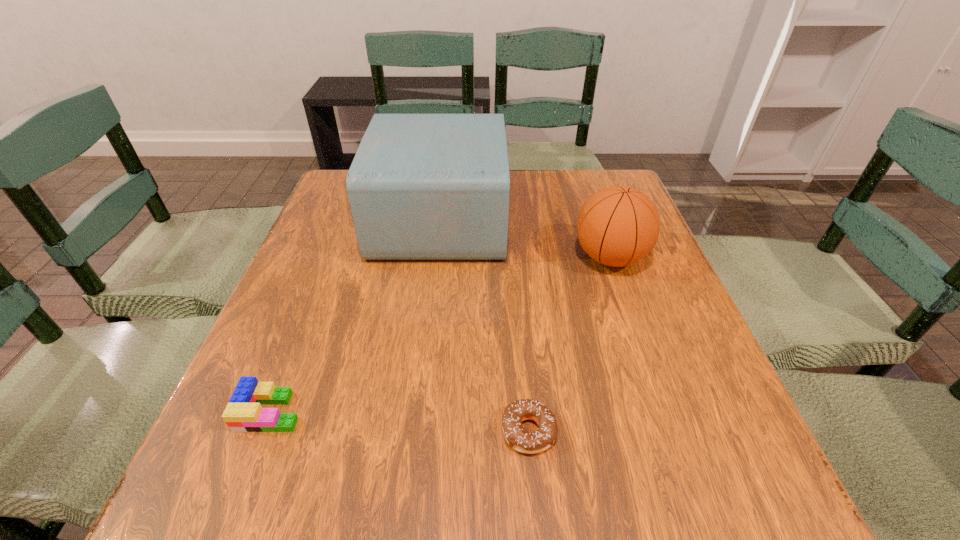
Select which object is the second closest to the doughnut. Please provide its 2D coordinates. Your answer should be formatted as a tuple, i.e. [(x, y)], where the tuple contains the x and y coordinates of a point satisfying the conditions above.

[(243, 413)]

This screenshot has width=960, height=540. I want to click on object that is the third nearest to the doughnut, so click(421, 186).

Where is `free location that satisfies the following two spatial constraints: 1. on the front panel of the second tallest object; 2. on the right side of the radio receiver`? free location that satisfies the following two spatial constraints: 1. on the front panel of the second tallest object; 2. on the right side of the radio receiver is located at coordinates (436, 258).

Find the location of `free spot that satisfies the following two spatial constraints: 1. on the front panel of the shortest object; 2. on the right side of the radio receiver`. free spot that satisfies the following two spatial constraints: 1. on the front panel of the shortest object; 2. on the right side of the radio receiver is located at coordinates (416, 431).

Identify the location of blank area in the image that satisfies the following two spatial constraints: 1. on the back side of the doughnut; 2. on the front panel of the radio receiver. The image size is (960, 540). (510, 219).

Find the location of a particular element. free spot that satisfies the following two spatial constraints: 1. on the front panel of the radio receiver; 2. on the back side of the second tallest object is located at coordinates (436, 258).